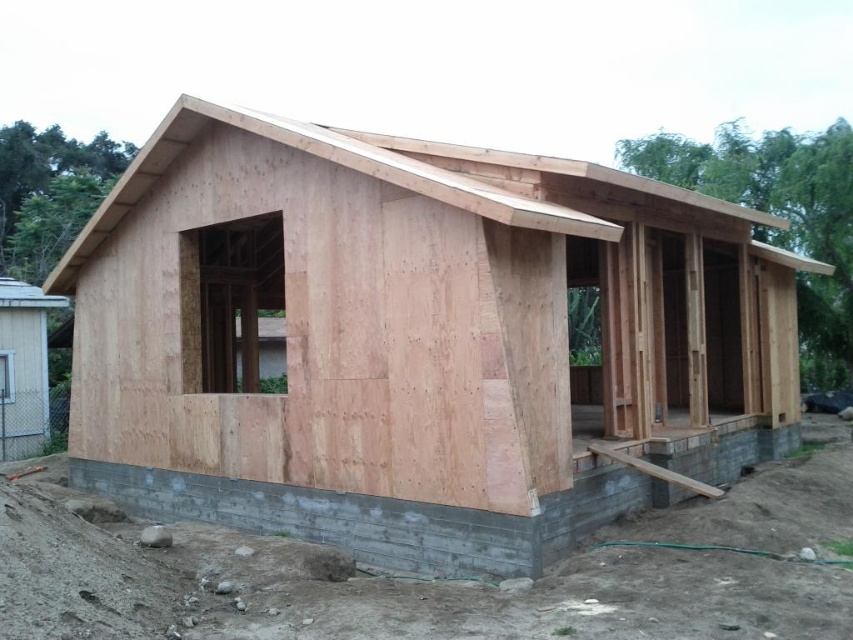
Does point (788, 256) come behind point (339, 548)?

Yes, it is behind point (339, 548).

Does point (573, 500) come closer to viewer compared to point (148, 512)?

Yes, point (573, 500) is in front of point (148, 512).

Between point (784, 292) and point (605, 481), which one is positioned behind?

Positioned behind is point (784, 292).

Identify the location of natural wood house at center. This screenshot has height=640, width=853. (415, 339).

Is point (502, 576) closer to viewer compared to point (132, 182)?

Yes.

Which of these two, gray concrete foundation at lower center or natural wood roof at upper center, stands shorter?

gray concrete foundation at lower center is shorter.

Does point (256, 513) come closer to viewer compared to point (242, 122)?

No, (256, 513) is behind (242, 122).

At what (x,y) coordinates should I click in order to perform the action: click on gray concrete foundation at lower center. Please return your answer as a coordinate pair (x, y). Looking at the image, I should click on (386, 515).

Can you confirm if natural wood house at center is bigger than natural wood roof at upper center?

No.

Between point (131, 500) and point (596, 180), which one is positioned behind?

Positioned behind is point (131, 500).

Is point (440, 232) closer to viewer compared to point (132, 188)?

Yes.

Where is `natural wood house at center`? This screenshot has width=853, height=640. natural wood house at center is located at coordinates (415, 339).